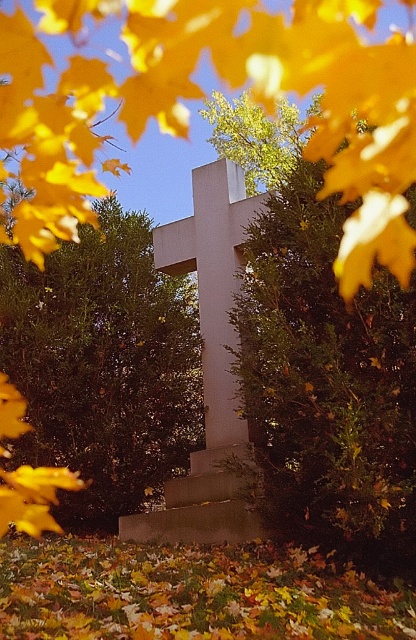
I want to click on green leafy bush at center, so click(x=319, y=356).

Measure the distance between point (314, 332) and camera.

A distance of 17.26 feet exists between point (314, 332) and camera.

Identify the location of green leafy bush at center. The height and width of the screenshot is (640, 416). (319, 356).

Is green leafy bush at center positioned before white smooth cross at center?

Yes, it is.

Who is taller, green leafy bush at center or white smooth cross at center?

With more height is white smooth cross at center.

The height and width of the screenshot is (640, 416). What do you see at coordinates (319, 356) in the screenshot?
I see `green leafy bush at center` at bounding box center [319, 356].

You are a GUI agent. You are given a task and a screenshot of the screen. Output one action in this format:
    pyautogui.click(x=<x>, y=<y>)
    Task: Click on the green leafy bush at center
    The height and width of the screenshot is (640, 416).
    Given the screenshot: What is the action you would take?
    pyautogui.click(x=319, y=356)

Is green leafy tree at center closer to the viewer compared to white smooth cross at center?

No, green leafy tree at center is behind white smooth cross at center.

Which is in front, point (175, 280) or point (235, 250)?

Point (235, 250) is in front.

Between point (64, 385) and point (235, 193), which one is positioned in front?

Point (64, 385) is in front.

Where is `green leafy tree at center`? green leafy tree at center is located at coordinates click(104, 365).